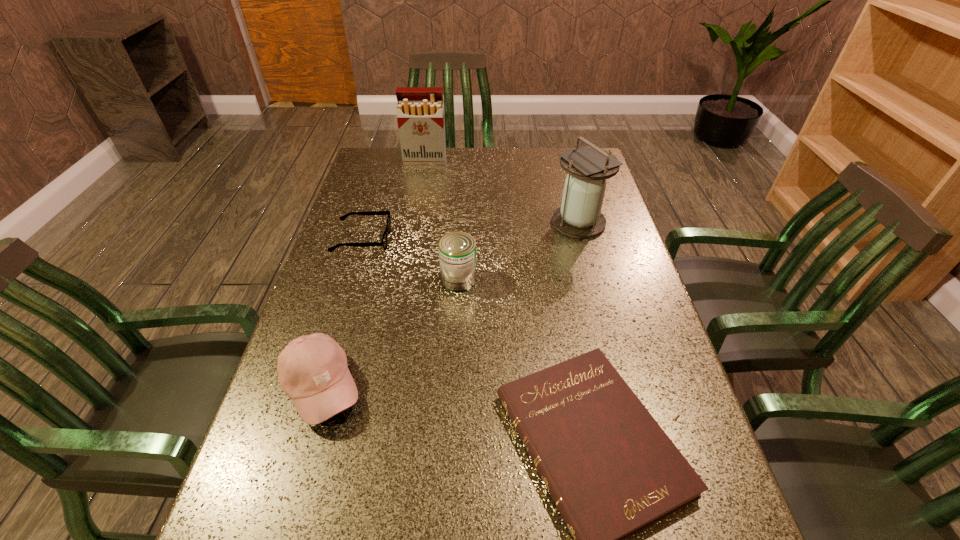
The width and height of the screenshot is (960, 540). Identify the location of lantern. (579, 216).

Where is `the farthest object`? The width and height of the screenshot is (960, 540). the farthest object is located at coordinates (420, 113).

Where is `the third nearest object`? The image size is (960, 540). the third nearest object is located at coordinates (457, 250).

Image resolution: width=960 pixels, height=540 pixels. In order to click on the third object from right to left in this screenshot , I will do `click(457, 250)`.

Image resolution: width=960 pixels, height=540 pixels. Identify the location of baseball cap. (312, 370).

Where is `spectacles`? Image resolution: width=960 pixels, height=540 pixels. spectacles is located at coordinates (383, 243).

The height and width of the screenshot is (540, 960). Identify the location of vacant space located on the back of the lantern. (561, 153).

The image size is (960, 540). In order to click on free point located 0.210m with the lid open on the cigarette case in this screenshot , I will do `click(419, 196)`.

Locate an element on the screen. The height and width of the screenshot is (540, 960). vacant point located on the front of the third object from right to left is located at coordinates (456, 335).

The image size is (960, 540). I want to click on free space located 0.260m on the front-facing side of the baseball cap, so click(489, 387).